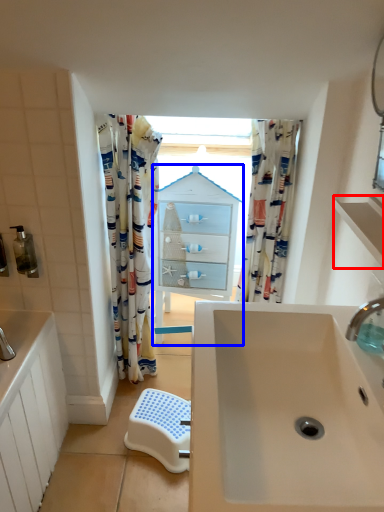
Question: Which object is closer to the camera taking this photo, balustrade (highlighted by a red box) or medicine cabinet (highlighted by a blue box)?

Choices:
 (A) balustrade
 (B) medicine cabinet

Answer: (A)